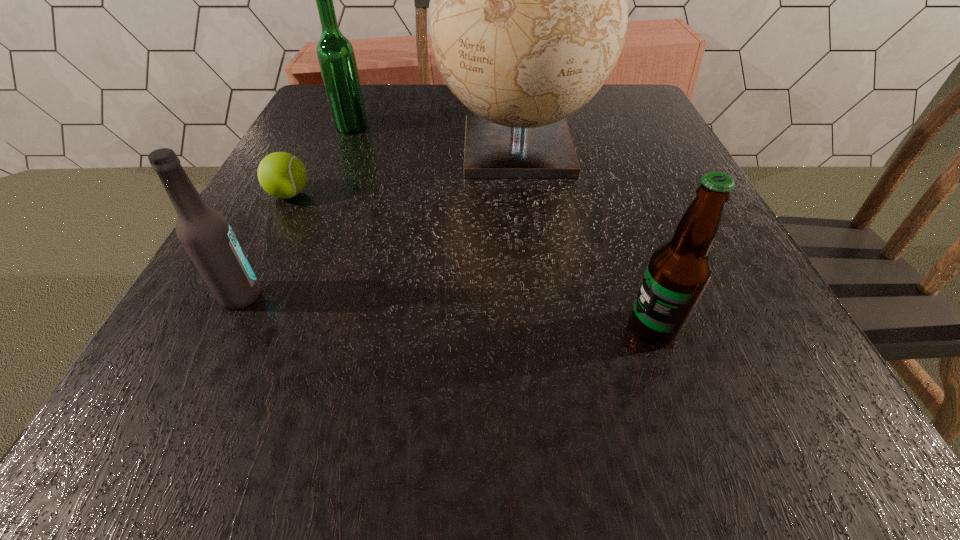
What are the coordinates of `globe at the far edge` in the screenshot? It's located at (528, 13).

In order to click on beer bottle that is at the far edge in this screenshot , I will do click(336, 57).

Locate an element on the screen. tennis ball located at the left edge is located at coordinates tap(282, 175).

The width and height of the screenshot is (960, 540). Find the location of `globe situated at the right edge`. globe situated at the right edge is located at coordinates (528, 13).

This screenshot has height=540, width=960. I want to click on beer bottle located in the right edge section of the desktop, so click(x=679, y=271).

Where is `object at the far left corner`? Image resolution: width=960 pixels, height=540 pixels. object at the far left corner is located at coordinates (336, 57).

Identify the location of object that is at the far right corner. (528, 13).

Locate an element on the screen. vacant position at the far edge of the desktop is located at coordinates (390, 112).

Image resolution: width=960 pixels, height=540 pixels. I want to click on vacant space at the near edge, so click(x=461, y=424).

Where is `vacant space at the left edge of the desktop`? The width and height of the screenshot is (960, 540). vacant space at the left edge of the desktop is located at coordinates (315, 272).